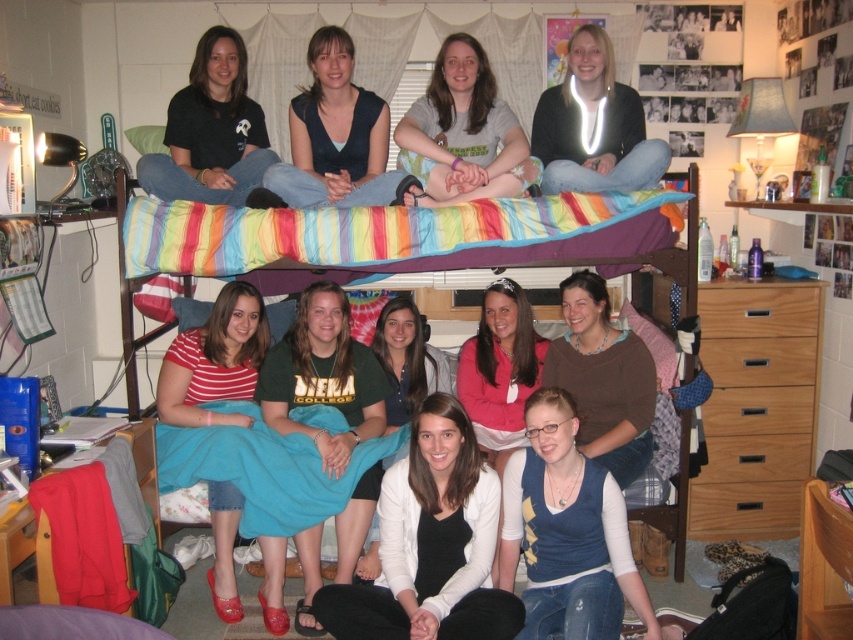
From the picture: You are helping organize a clothing donation drive and need to determine which item takes up more space in the donation box. Based on the image, which item is wider, the denim vest at lower center or the matte gray shirt at center?

The denim vest at lower center is less wide than the matte gray shirt at center, so the matte gray shirt at center takes up more space in the donation box.

Two people are standing at points marked as point (299, 168) and point 0.654, 0.789 respectively. If you want to place a small table between them, what is the minimum distance the table should be able to cover?

The minimum distance the table should be able to cover is 10.98 feet to accommodate the space between the two points.

You are organizing a dorm room photoshoot and need to ensure that all clothing items are visible in the frame. Given that the denim vest at lower center and the matte gray shirt at center are both in the shot, which clothing item takes up more space in the photo?

The denim vest at lower center occupies less space than the matte gray shirt at center, so the matte gray shirt at center takes up more space in the photo.